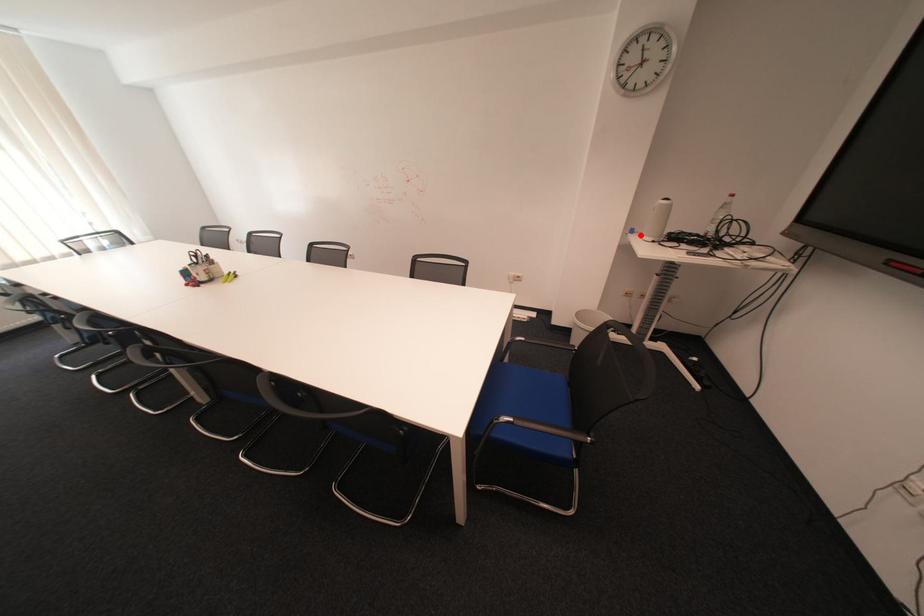
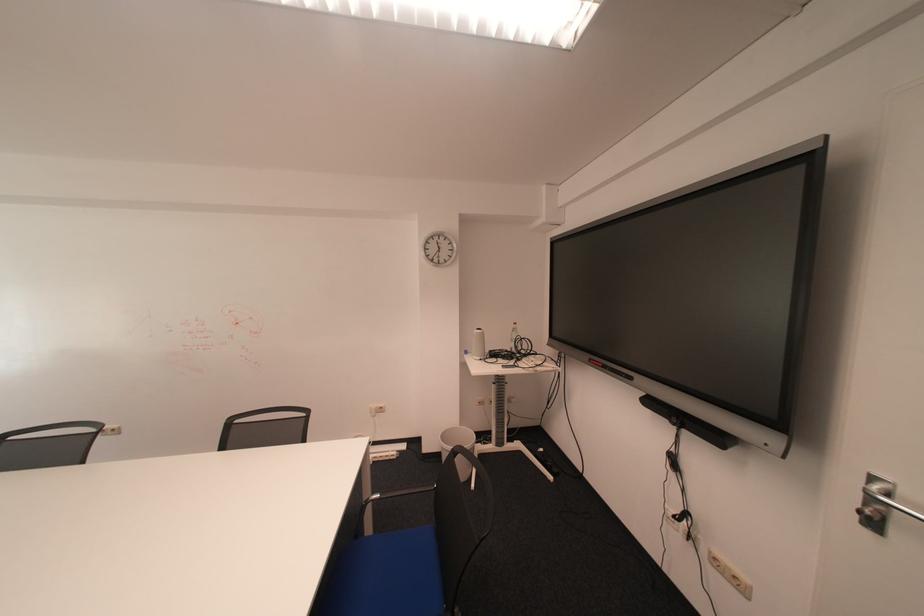
Find the pixel in the second image that matches the highlighted location in the first image.

(477, 355)